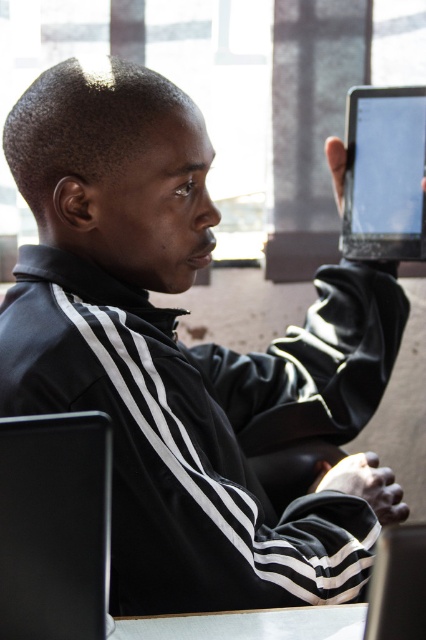
Question: Can you confirm if black matte laptop at lower left is positioned below black glossy tablet at upper right?

Choices:
 (A) no
 (B) yes

Answer: (B)

Question: Which is farther from the white glossy table at lower center?

Choices:
 (A) black glossy tablet at upper right
 (B) black matte laptop at lower left
 (C) black glossy laptop at lower right

Answer: (A)

Question: Can you confirm if black glossy tablet at upper right is thinner than black glossy laptop at lower right?

Choices:
 (A) yes
 (B) no

Answer: (B)

Question: Does black glossy tablet at upper right have a lesser width compared to white glossy table at lower center?

Choices:
 (A) yes
 (B) no

Answer: (B)

Question: Which of the following is the closest to the observer?

Choices:
 (A) black matte laptop at lower left
 (B) white glossy table at lower center

Answer: (A)

Question: Estimate the real-world distances between objects in this image. Which object is farther from the black glossy tablet at upper right?

Choices:
 (A) black matte laptop at lower left
 (B) black glossy laptop at lower right

Answer: (B)